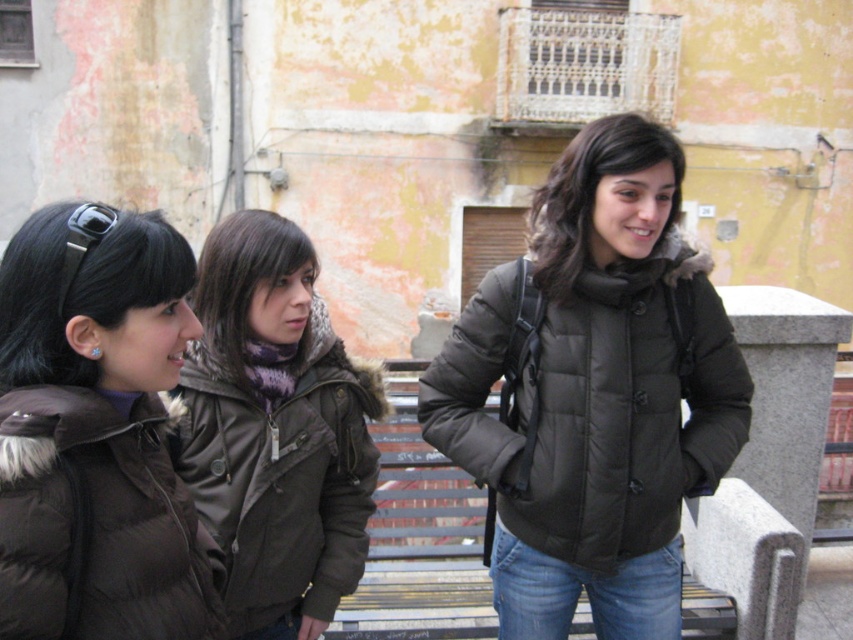
You are trying to decide which jacket between the matte brown jacket at center and the black down jacket at left would be easier to walk through a narrow hallway. Based on their widths, which one should you choose?

The matte brown jacket at center might be wider than black down jacket at left, so the black down jacket at left would be easier to walk through a narrow hallway since it is narrower.